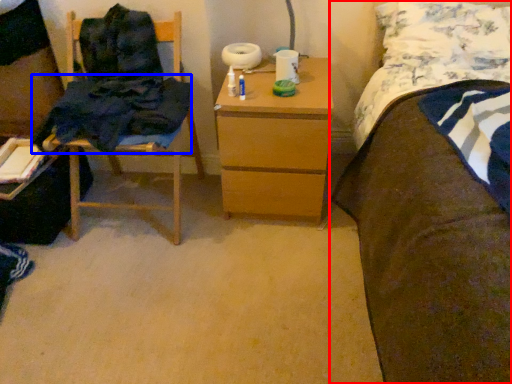
Question: Which object appears farthest to the camera in this image, bed (highlighted by a red box) or clothing (highlighted by a blue box)?

Choices:
 (A) bed
 (B) clothing

Answer: (B)